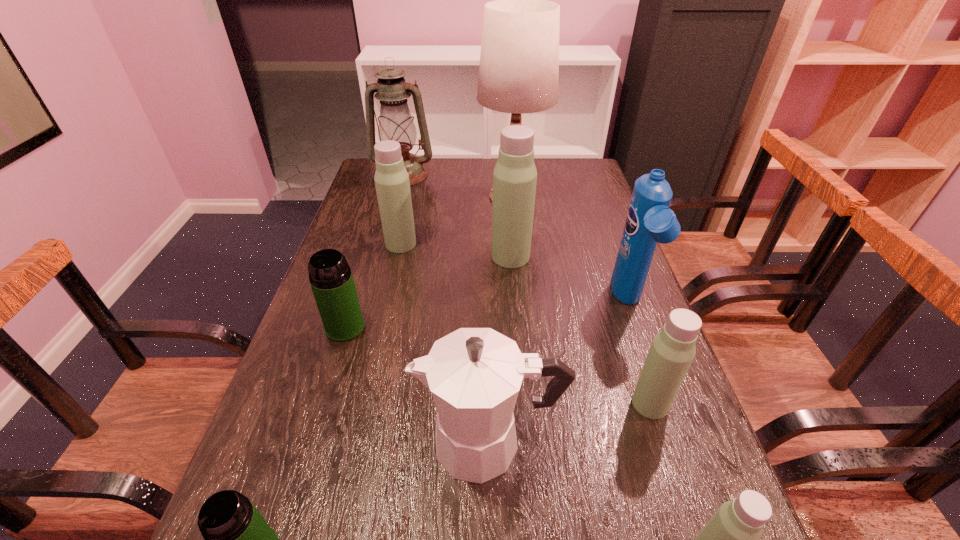
Locate an element on the screen. This screenshot has width=960, height=540. the third biggest light thermos bottle is located at coordinates (672, 351).

The width and height of the screenshot is (960, 540). In order to click on the third nearest thermos bottle in this screenshot , I will do `click(672, 351)`.

Find the location of a particular element. free spot located 0.160m on the back of the lamp is located at coordinates (508, 159).

Identify the location of vacant point located 0.120m on the front of the oil lamp. Image resolution: width=960 pixels, height=540 pixels. (395, 206).

Find the location of a particular element. This screenshot has width=960, height=540. free space located on the back of the biggest light thermos bottle is located at coordinates (507, 214).

Where is `free region located 0.180m on the back of the shampoo`? The image size is (960, 540). free region located 0.180m on the back of the shampoo is located at coordinates (605, 237).

Locate an element on the screen. Image resolution: width=960 pixels, height=540 pixels. vacant space located on the right of the second biggest light thermos bottle is located at coordinates (541, 244).

Find the location of a particular element. This screenshot has height=540, width=960. vacant space located at the spout of the coffeepot is located at coordinates (287, 442).

Find the location of a particular element. vacant region located 0.070m at the spout of the coffeepot is located at coordinates (380, 442).

Find the location of `free space located 0.150m at the spout of the coffeepot`. free space located 0.150m at the spout of the coffeepot is located at coordinates tap(336, 442).